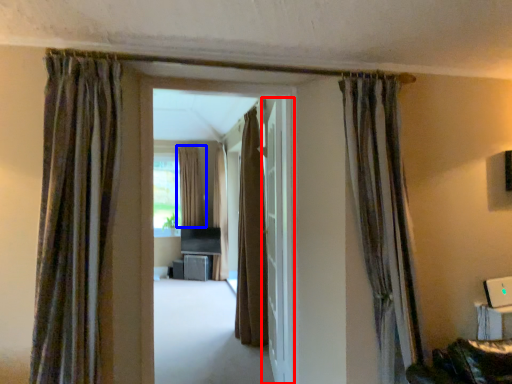
Question: Which object appears farthest to the camera in this image, door (highlighted by a red box) or curtain (highlighted by a blue box)?

Choices:
 (A) door
 (B) curtain

Answer: (B)